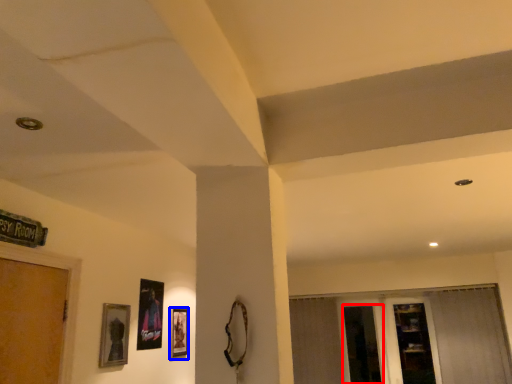
Question: Among these objects, which one is farthest to the camera, screen door (highlighted by a red box) or picture frame (highlighted by a blue box)?

Choices:
 (A) screen door
 (B) picture frame

Answer: (A)